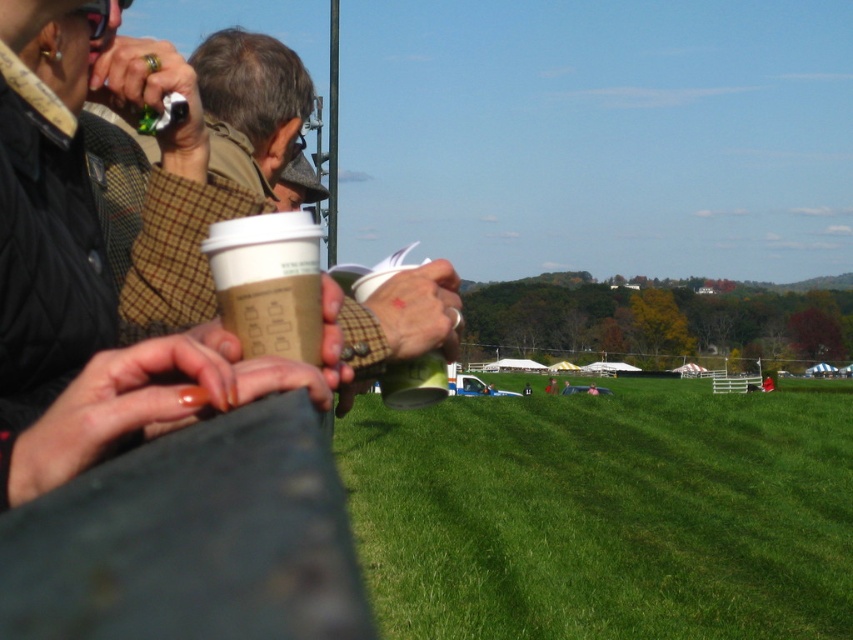
You are standing at the edge of the field and want to walk to the green grass at center. What direction should you walk in?

The green grass at center is located at point 0.803 on the x axis and 0.712 on the y axis. To reach it, you should walk towards the center of the field.

You are at an outdoor event and see the green grass at center and the matte brown paper cup at center. Which object is located to the right of the other?

The green grass at center is positioned on the right side of matte brown paper cup at center.

You are organizing a picnic and need to place a picnic basket on the green grass at center. However, there is a matte brown paper cup at center already there. Can the basket fit on the grass without moving the cup?

The green grass at center is larger in size than the matte brown paper cup at center, so yes, the picnic basket can fit on the green grass at center without moving the cup.